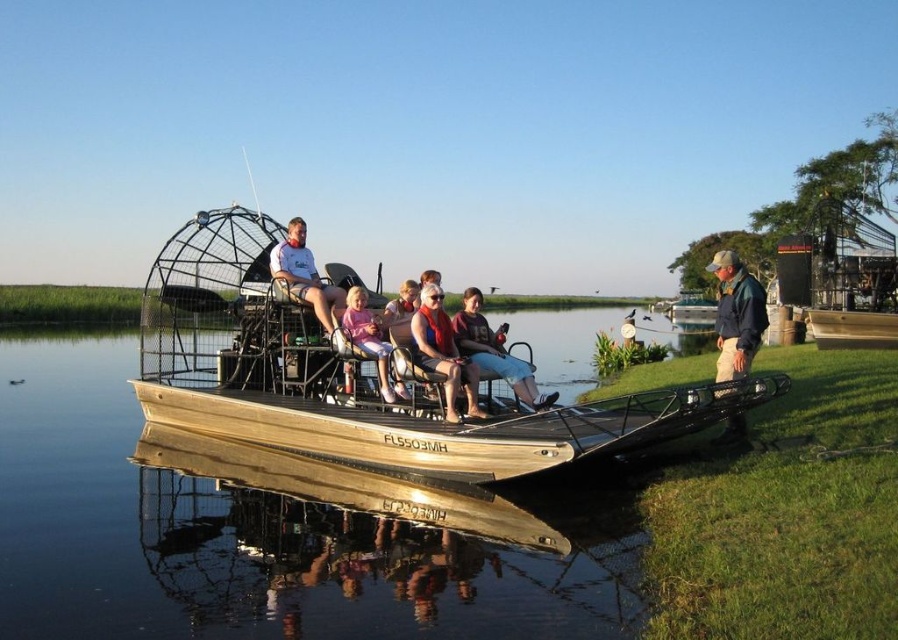
You are a passenger on the airboat and want to place your pink fabric baby carriage at center on the smooth brown water at center. Is this possible?

The smooth brown water at center is below the pink fabric baby carriage at center, so placing the pink fabric baby carriage at center on the water is not possible because it is already positioned above the water.

You are planning to place the pink fabric baby carriage at center onto the smooth brown water at center. Based on their sizes, will the carriage fit entirely on the water surface without overhanging?

The smooth brown water at center is wider than the pink fabric baby carriage at center, so the carriage will fit entirely on the water surface without overhanging.

You are a photographer standing on the grassy shoreline and want to take a photo of the smooth brown water at center and the pink fabric baby carriage at center. Which object will appear larger in your photo?

The smooth brown water at center will appear larger in the photo because it is closer to the viewer than the pink fabric baby carriage at center.